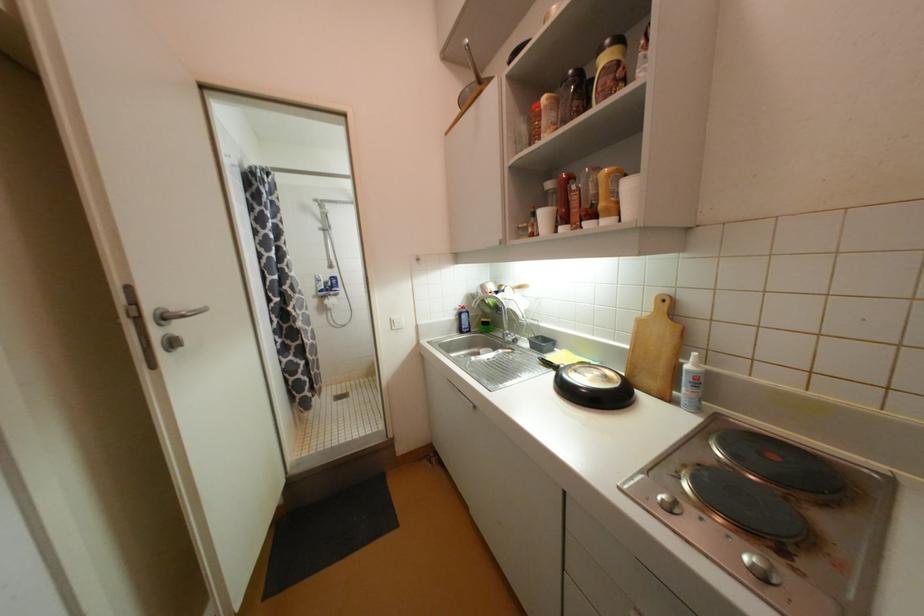
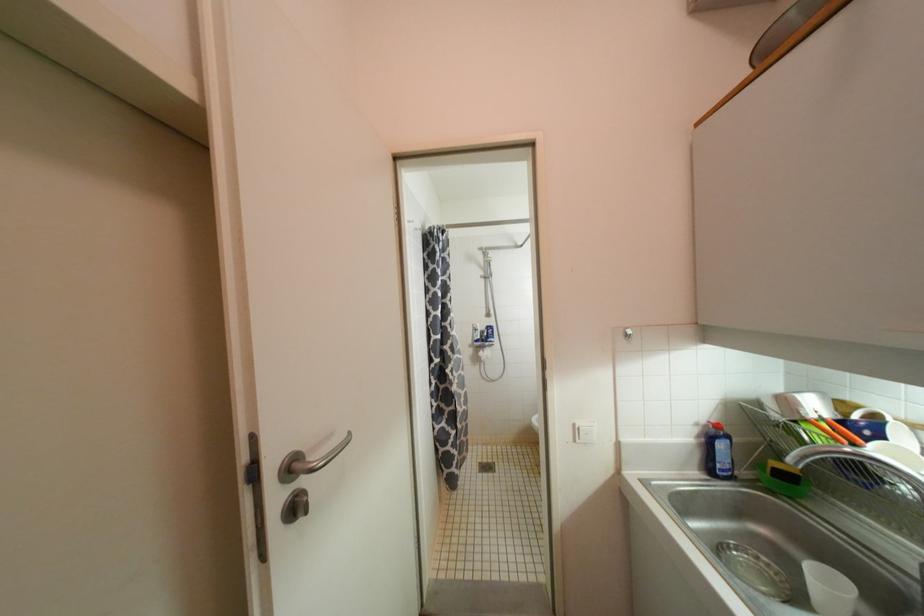
Question: The camera is either moving clockwise (left) or counter-clockwise (right) around the object. The first image is from the beginning of the video and the second image is from the end. Is the camera moving left or right when shooting the video?

Choices:
 (A) Left
 (B) Right

Answer: (B)